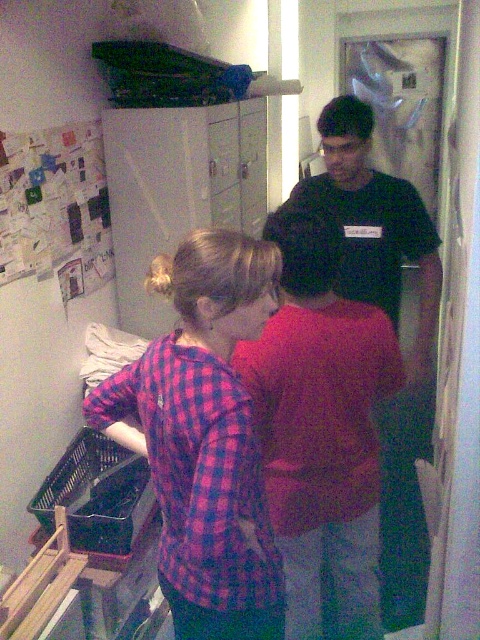
Does point (317, 467) lie in front of point (412, 204)?

Yes, point (317, 467) is in front of point (412, 204).

Measure the distance from matte red shirt at center to black matte shirt at center.

They are 22.20 inches apart.

Which is in front, point (314, 476) or point (360, 220)?

Positioned in front is point (314, 476).

Find the location of a particular element. matte red shirt at center is located at coordinates (321, 428).

Which is in front, point (176, 365) or point (275, 316)?

Positioned in front is point (176, 365).

Who is lower down, plaid fabric shirt at center or matte red shirt at center?

Positioned lower is matte red shirt at center.

The width and height of the screenshot is (480, 640). I want to click on plaid fabric shirt at center, so click(x=204, y=436).

Identify the location of plaid fabric shirt at center. Image resolution: width=480 pixels, height=640 pixels. (204, 436).

Does plaid fabric shirt at center have a larger size compared to black matte shirt at center?

No.

Does point (202, 294) come closer to viewer compared to point (402, 234)?

Yes.

You are a GUI agent. You are given a task and a screenshot of the screen. Output one action in this format:
    pyautogui.click(x=<x>, y=<y>)
    Task: Click on the plaid fabric shirt at center
    
    Given the screenshot: What is the action you would take?
    pyautogui.click(x=204, y=436)